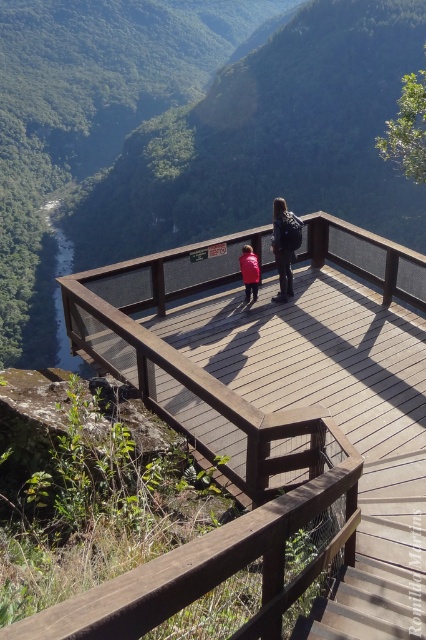
You are standing on the wooden platform overlooking the valley. You want to locate the brown wooden bridge at center. Where should you look relative to your position?

The brown wooden bridge at center is located at the coordinates point (275, 362), so you should look towards the center of the valley to find it.

You are standing on the wooden platform at the overlook. There is a point marked at coordinates (189, 136). What is the material of the surface at that point?

The point (189, 136) is on the green matte wooden platform at center, so the material is wooden.

Looking at this image, you are planning to take a photo of the brown wooden bridge at center and the red matte jacket at center from the wooden platform. Which object will appear larger in the photo?

The brown wooden bridge at center will appear larger in the photo because it is bigger than the red matte jacket at center.